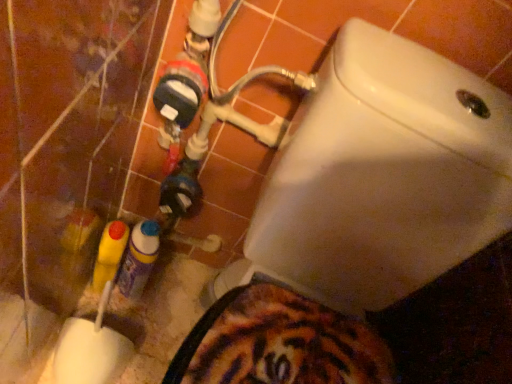
Question: From the image's perspective, is yellow plastic bottle at lower left, the second bottle when ordered from right to left, located beneath white glossy toilet at upper right?

Choices:
 (A) yes
 (B) no

Answer: (B)

Question: Does yellow plastic bottle at lower left, the 1th bottle in the left-to-right sequence, have a lesser height compared to white glossy toilet at upper right?

Choices:
 (A) no
 (B) yes

Answer: (B)

Question: Is yellow plastic bottle at lower left, the second bottle when ordered from right to left, at the right side of white glossy toilet at upper right?

Choices:
 (A) yes
 (B) no

Answer: (B)

Question: From the image's perspective, is yellow plastic bottle at lower left, the 1th bottle in the left-to-right sequence, above white glossy toilet at upper right?

Choices:
 (A) yes
 (B) no

Answer: (A)

Question: Is yellow plastic bottle at lower left, the 1th bottle in the left-to-right sequence, surrounding white glossy toilet at upper right?

Choices:
 (A) yes
 (B) no

Answer: (B)

Question: From the image's perspective, is translucent plastic spray can at lower left, acting as the 1th bottle starting from the right, above or below yellow plastic bottle at lower left, the 1th bottle in the left-to-right sequence?

Choices:
 (A) below
 (B) above

Answer: (A)

Question: In terms of height, does translucent plastic spray can at lower left, the second bottle positioned from the left, look taller or shorter compared to yellow plastic bottle at lower left, the 1th bottle in the left-to-right sequence?

Choices:
 (A) tall
 (B) short

Answer: (A)

Question: Visually, is translucent plastic spray can at lower left, the second bottle positioned from the left, positioned to the left or to the right of yellow plastic bottle at lower left, the second bottle when ordered from right to left?

Choices:
 (A) right
 (B) left

Answer: (A)

Question: Is translucent plastic spray can at lower left, the second bottle positioned from the left, bigger or smaller than yellow plastic bottle at lower left, the second bottle when ordered from right to left?

Choices:
 (A) small
 (B) big

Answer: (B)

Question: From a real-world perspective, is white glossy toilet at upper right physically located above or below yellow plastic bottle at lower left, the second bottle when ordered from right to left?

Choices:
 (A) below
 (B) above

Answer: (B)

Question: From the image's perspective, is white glossy toilet at upper right located above or below yellow plastic bottle at lower left, the 1th bottle in the left-to-right sequence?

Choices:
 (A) below
 (B) above

Answer: (A)

Question: Based on their positions, is white glossy toilet at upper right located to the left or right of yellow plastic bottle at lower left, the 1th bottle in the left-to-right sequence?

Choices:
 (A) left
 (B) right

Answer: (B)

Question: In terms of width, does white glossy toilet at upper right look wider or thinner when compared to yellow plastic bottle at lower left, the second bottle when ordered from right to left?

Choices:
 (A) thin
 (B) wide

Answer: (B)

Question: Is white glossy toilet at upper right taller or shorter than translucent plastic spray can at lower left, the second bottle positioned from the left?

Choices:
 (A) tall
 (B) short

Answer: (A)

Question: Does point (402, 97) appear closer or farther from the camera than point (158, 238)?

Choices:
 (A) closer
 (B) farther

Answer: (A)